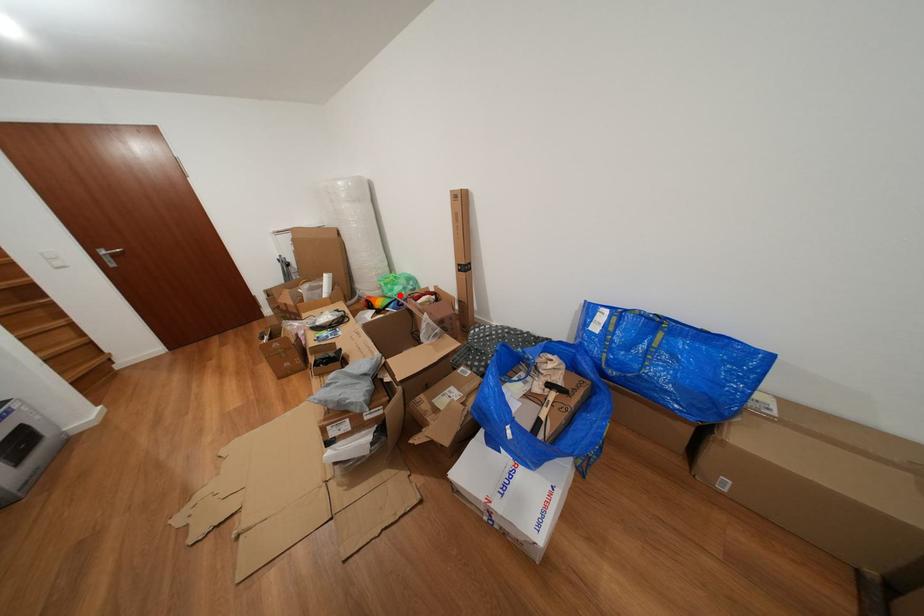
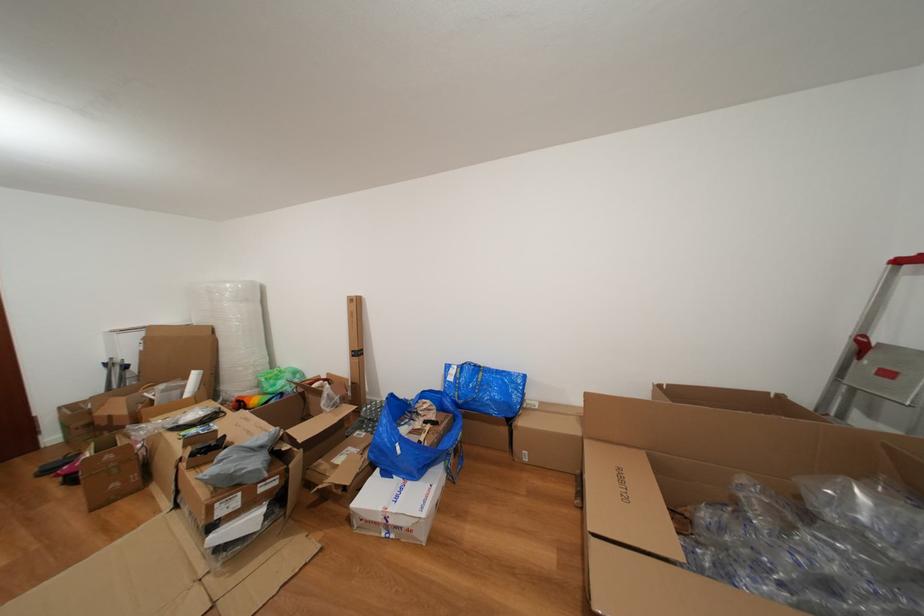
Where in the second image is the point corresponding to the highlighted location from the first image?

(283, 390)